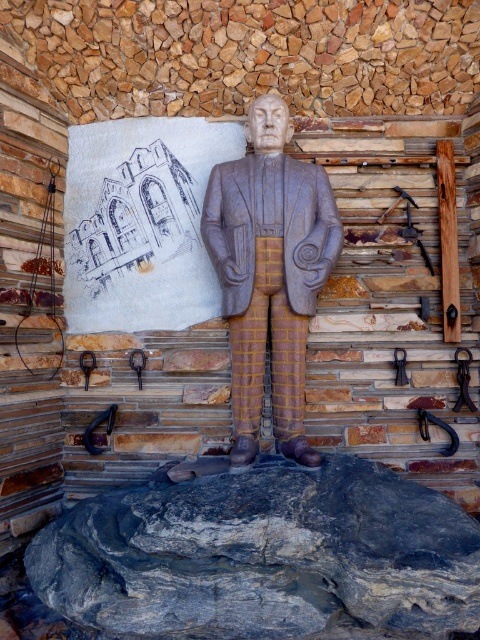
Does gray/rocky stone at center have a greater width compared to matte stone statue at center?

Correct, the width of gray/rocky stone at center exceeds that of matte stone statue at center.

Can you confirm if gray/rocky stone at center is positioned to the left of matte stone statue at center?

Yes, gray/rocky stone at center is to the left of matte stone statue at center.

Who is more distant from viewer, [121,534] or [240,358]?

Point [240,358]

Identify the location of gray/rocky stone at center. (264, 556).

Does gray/rocky stone at center appear on the right side of dark brown leather tool at right?

Incorrect, gray/rocky stone at center is not on the right side of dark brown leather tool at right.

Is point (127, 564) positioned after point (460, 396)?

No, it is in front of (460, 396).

What do you see at coordinates (264, 556) in the screenshot? The height and width of the screenshot is (640, 480). I see `gray/rocky stone at center` at bounding box center [264, 556].

What are the coordinates of `gray/rocky stone at center` in the screenshot? It's located at (264, 556).

Does dark brown leather tool at right have a greater width compared to brushed metal hook at lower left?

Yes.

Is point (460, 371) behind point (86, 362)?

No, (460, 371) is closer to viewer.

Find the location of a particular element. This screenshot has height=640, width=480. dark brown leather tool at right is located at coordinates (464, 378).

The height and width of the screenshot is (640, 480). I want to click on dark brown leather tool at right, so click(x=464, y=378).